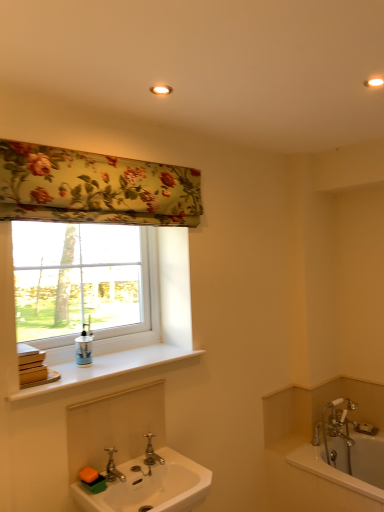
Locate an element on the screen. This screenshot has height=512, width=384. free spot behind matte white recessed light at upper center is located at coordinates (161, 105).